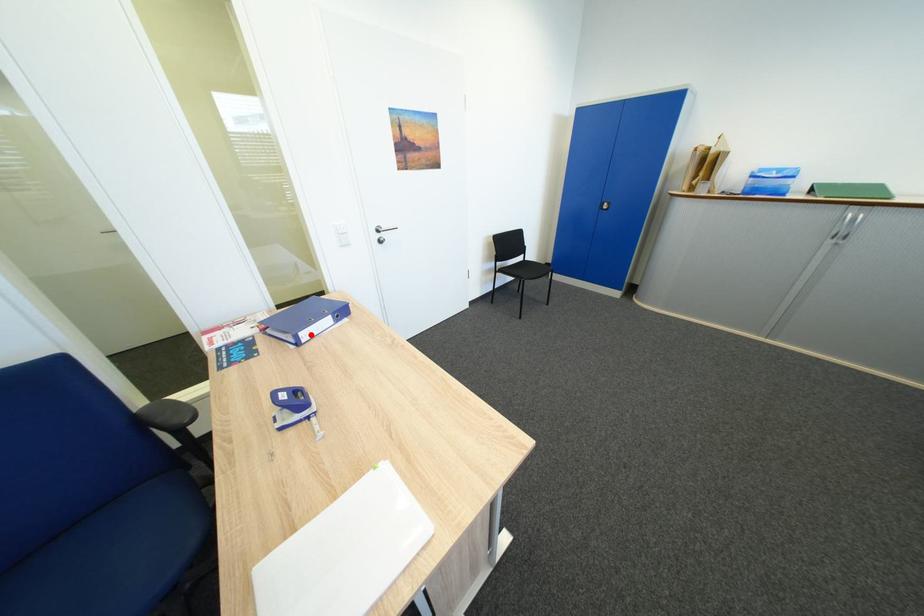
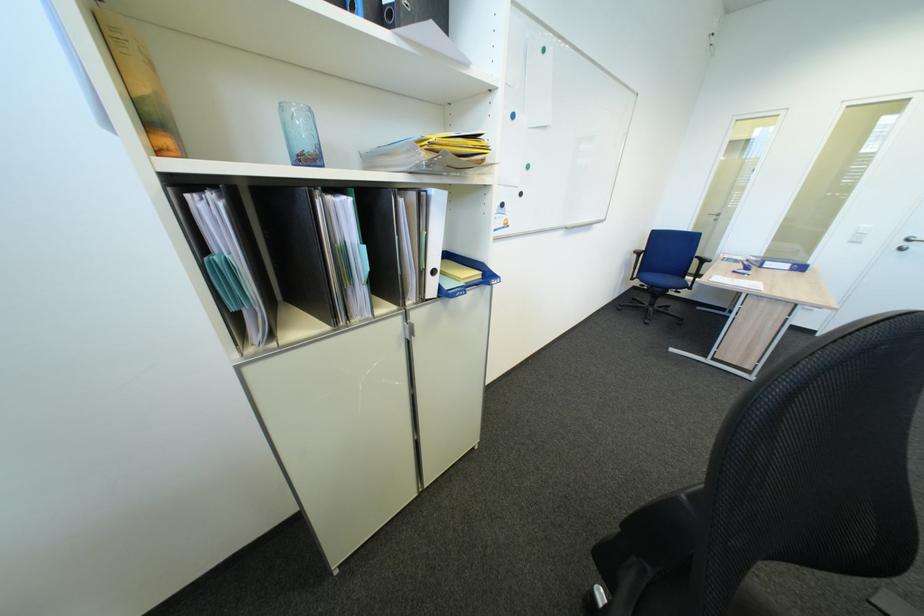
Question: I am providing you with two images of the same scene from different viewpoints. A red point is shown in image1. For the corresponding object point in image2, is it positioned nearer or farther from the camera?

Choices:
 (A) Nearer
 (B) Farther

Answer: (B)